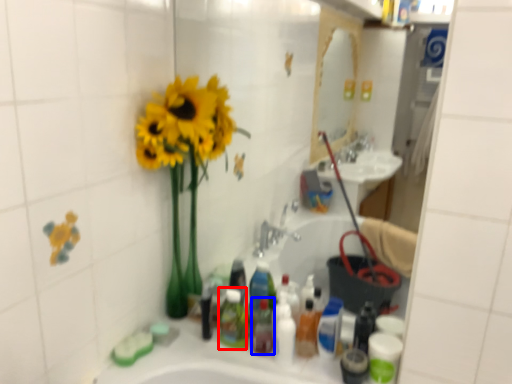
Question: Which point is further to the camera, toiletry (highlighted by a red box) or mouthwash (highlighted by a blue box)?

Choices:
 (A) toiletry
 (B) mouthwash

Answer: (A)